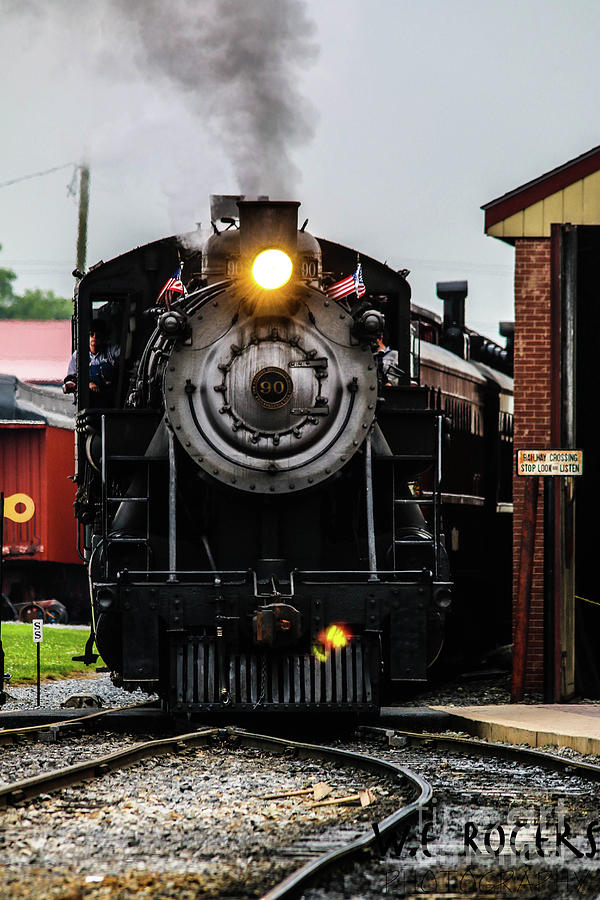
Where is `pillar`? pillar is located at coordinates (535, 339).